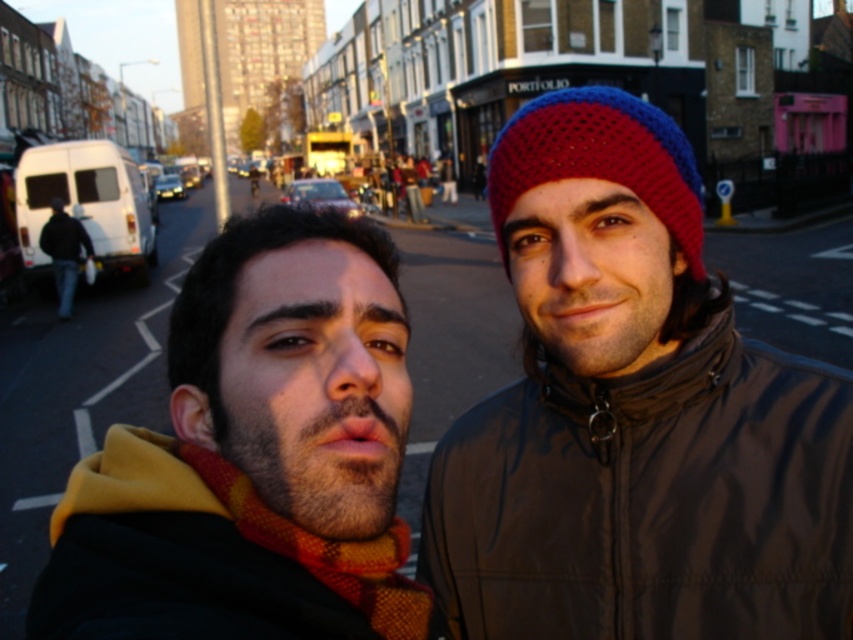
You are a delivery person who needs to locate the matte black jacket at center in the image. The coordinates given are in a normalized format where the top left corner is the origin. Can you confirm if the point at (254, 456) is the correct location for the matte black jacket at center?

Yes, the point at (254, 456) is the correct location for the matte black jacket at center as indicated by the coordinates provided.

You are a photographer trying to capture both the matte black jacket at center and the knitted woolen beanie at center in a single frame. Given their sizes, which object should you zoom in on to ensure both fit comfortably in the photo?

Since the matte black jacket at center is smaller than the knitted woolen beanie at center, you should zoom out slightly to ensure both fit comfortably in the photo.